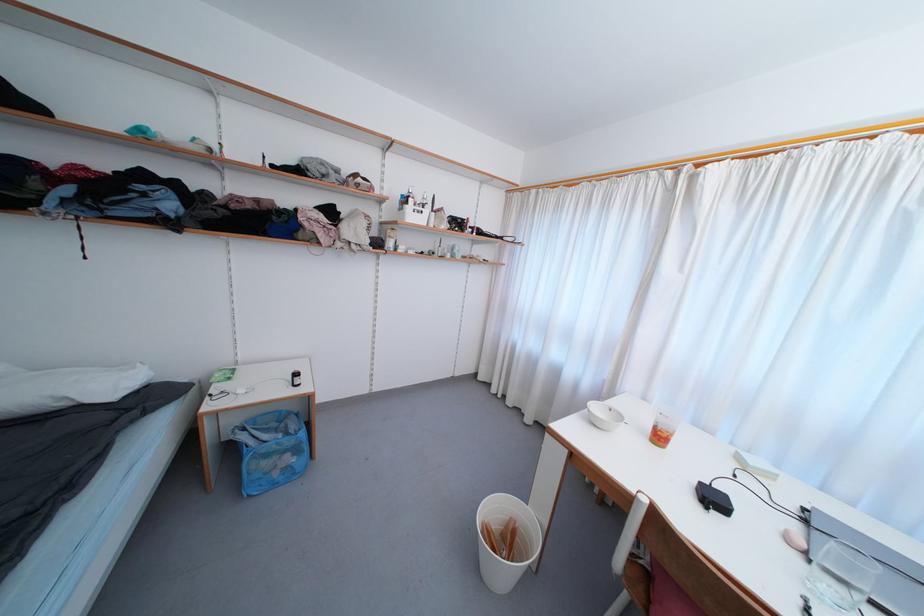
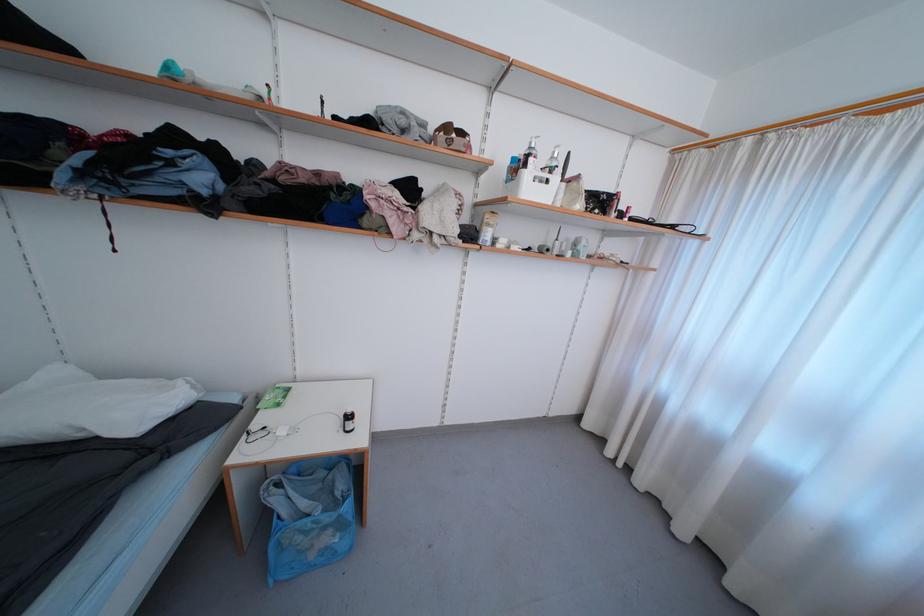
The images are taken continuously from a first-person perspective. In which direction are you moving?

The cameraman walked toward left, forward.